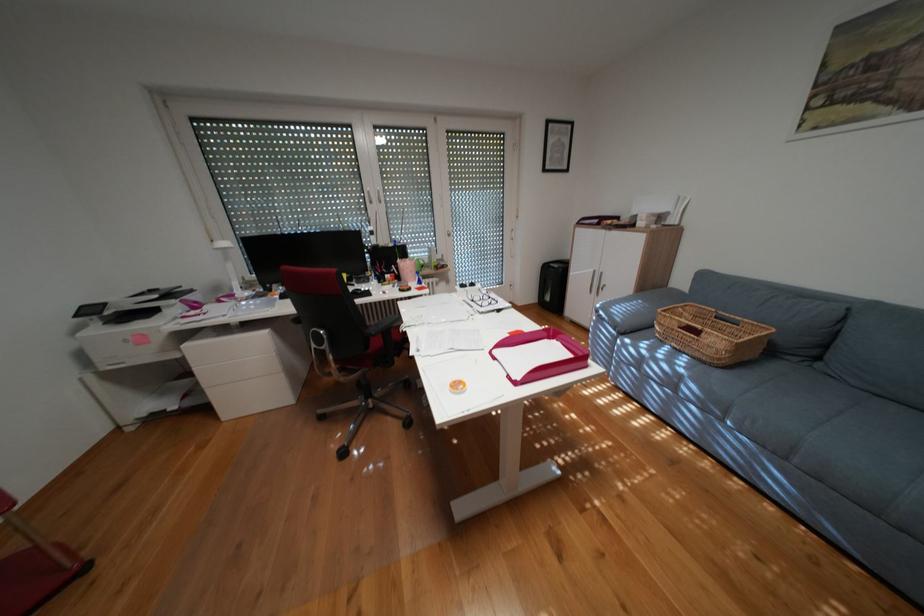
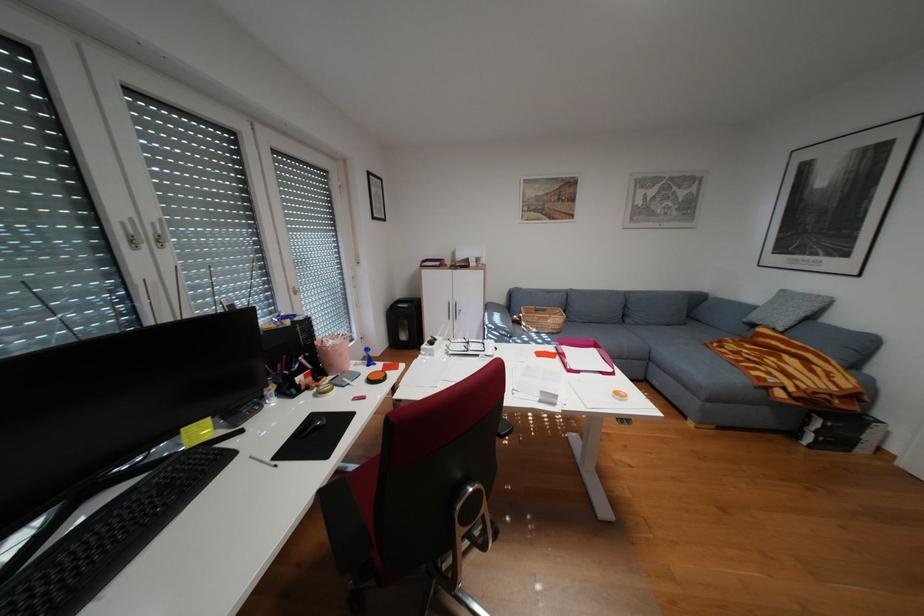
In the second image, find the point that corresponds to the point at 481,286 in the first image.

(448, 342)